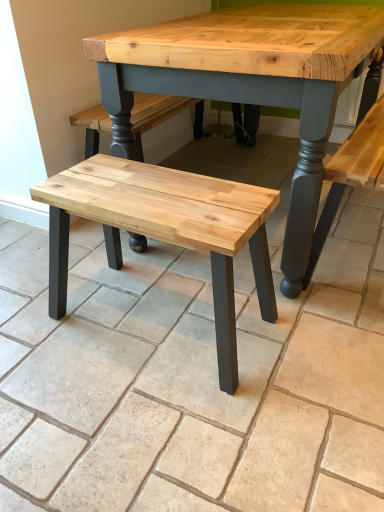
Question: From a real-world perspective, is natural wood stool at center above or below natural wood bench at center?

Choices:
 (A) below
 (B) above

Answer: (B)

Question: Is natural wood stool at center wider or thinner than natural wood bench at center?

Choices:
 (A) thin
 (B) wide

Answer: (A)

Question: Considering their positions, is natural wood stool at center located in front of or behind natural wood bench at center?

Choices:
 (A) front
 (B) behind

Answer: (B)

Question: From their relative heights in the image, would you say natural wood bench at center is taller or shorter than natural wood stool at center?

Choices:
 (A) short
 (B) tall

Answer: (A)

Question: From a real-world perspective, is natural wood bench at center above or below natural wood stool at center?

Choices:
 (A) below
 (B) above

Answer: (A)

Question: From the image's perspective, is natural wood bench at center above or below natural wood stool at center?

Choices:
 (A) below
 (B) above

Answer: (B)

Question: Would you say natural wood bench at center is inside or outside natural wood stool at center?

Choices:
 (A) outside
 (B) inside

Answer: (A)